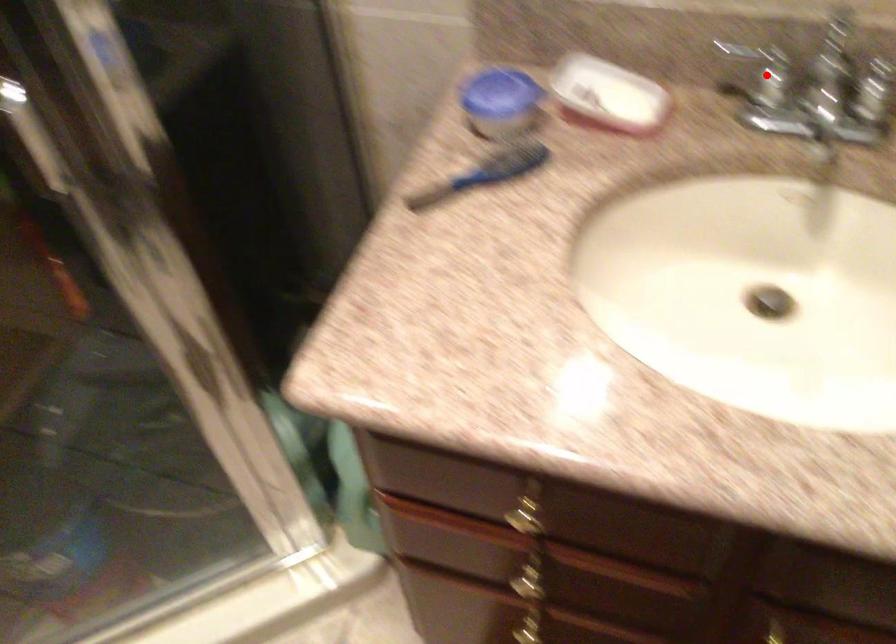
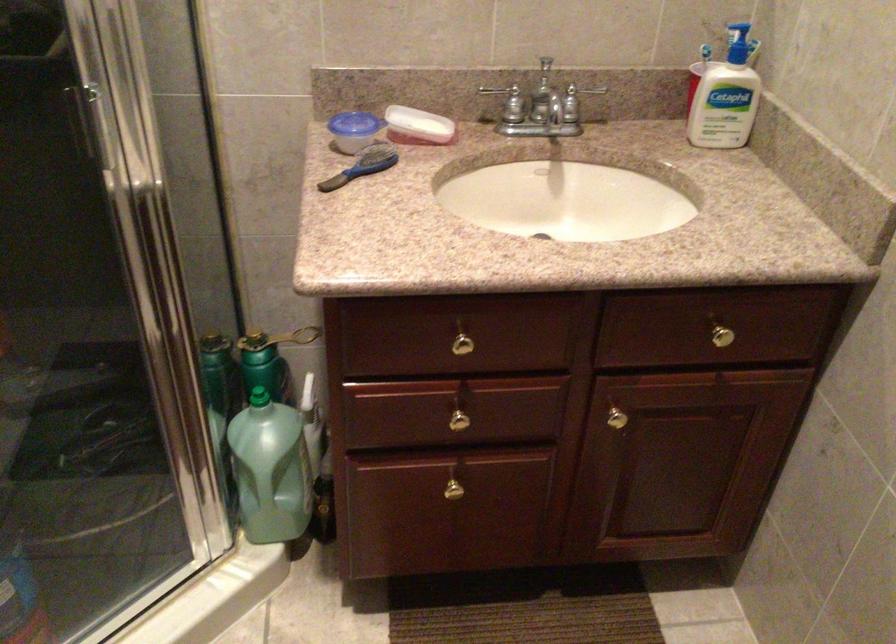
Question: I am providing you with two images of the same scene from different viewpoints. Image1 has a red point marked. In image2, the corresponding 3D location appears at what relative position? Reply with the corresponding letter.

Choices:
 (A) Closer
 (B) Farther

Answer: (B)